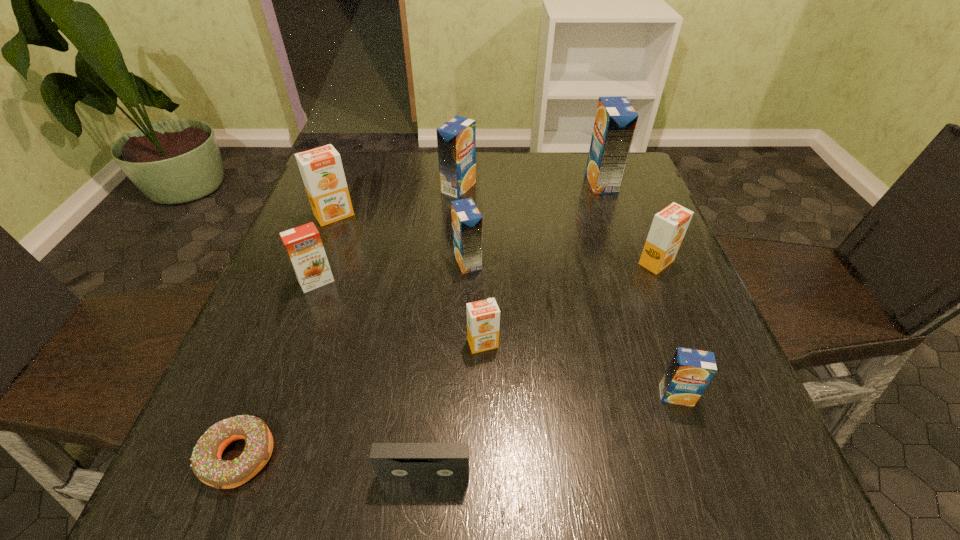
The image size is (960, 540). Identify the location of vacant region at the right edge of the desktop. (672, 348).

Where is `vacant space at the far left corner of the desktop`? Image resolution: width=960 pixels, height=540 pixels. vacant space at the far left corner of the desktop is located at coordinates pyautogui.click(x=372, y=152).

Identify the location of vacant point at the far right corner. The height and width of the screenshot is (540, 960). (646, 188).

Image resolution: width=960 pixels, height=540 pixels. Identify the location of vacant space that is in between the third smallest blue orange_juice and the rightmost orange orange juice. (558, 225).

Identify the location of unoccupied position between the chocolate doughnut and the nearest orange juice. (457, 426).

At what (x,y) coordinates should I click in order to perform the action: click on vacant area that lies between the tallest object and the third nearest object. Please return your answer as a coordinate pair (x, y). Looking at the image, I should click on (638, 289).

Locate an element on the screen. Image resolution: width=960 pixels, height=540 pixels. free space between the biggest blue orange_juice and the third smallest blue orange_juice is located at coordinates (530, 185).

Identify which object is located as the ninth nearest to the chocolate doughnut. Please provide its 2D coordinates. Your answer should be formatted as a tuple, i.e. [(x, y)], where the tuple contains the x and y coordinates of a point satisfying the conditions above.

[(615, 122)]

This screenshot has width=960, height=540. What are the coordinates of `object that is the eighth closest to the tallest orange juice` in the screenshot? It's located at (393, 462).

Identify which orange juice is located as the third nearest to the third smallest blue orange_juice. Please provide its 2D coordinates. Your answer should be formatted as a tuple, i.e. [(x, y)], where the tuple contains the x and y coordinates of a point satisfying the conditions above.

[(615, 122)]